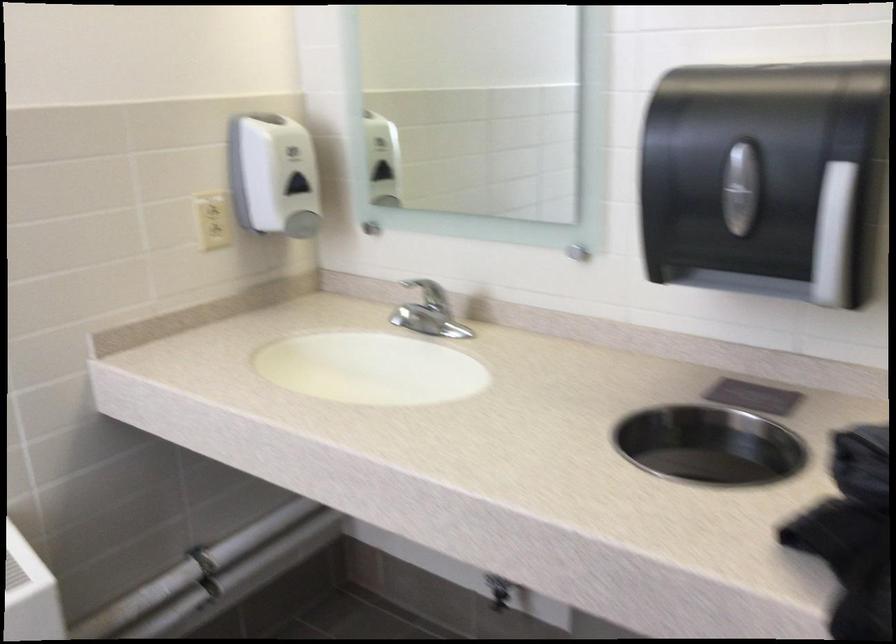
What do you see at coordinates (428, 313) in the screenshot?
I see `a chrome faucet handle` at bounding box center [428, 313].